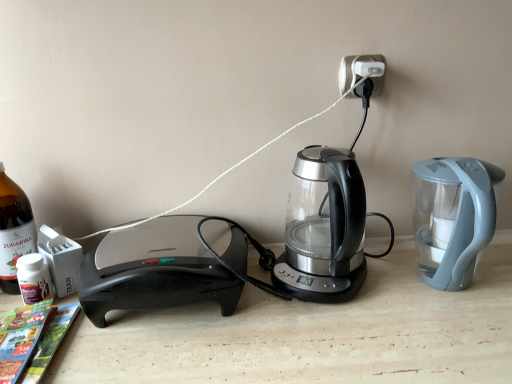
Measure the distance between bottle glass at left and camera.

A distance of 30.66 inches exists between bottle glass at left and camera.

I want to click on bottle glass at left, so click(14, 231).

What do you see at coordinates (362, 71) in the screenshot? I see `white plastic electric outlet at upper center` at bounding box center [362, 71].

Identify the location of bottle glass at left. (14, 231).

Is point (6, 232) closer to camera compared to point (379, 58)?

Yes.

Is white plastic electric outlet at upper center at the back of bottle glass at left?

bottle glass at left does not have its back to white plastic electric outlet at upper center.

In the scene shown: Considering the relative sizes of bottle glass at left and white plastic electric outlet at upper center in the image provided, is bottle glass at left smaller than white plastic electric outlet at upper center?

Actually, bottle glass at left might be larger than white plastic electric outlet at upper center.

Considering the positions of objects bottle glass at left and white plastic electric outlet at upper center in the image provided, who is more to the left, bottle glass at left or white plastic electric outlet at upper center?

bottle glass at left is more to the left.

From a real-world perspective, is transparent glass kettle at center located beneath white plastic electric outlet at upper center?

Yes, from a real-world perspective, transparent glass kettle at center is under white plastic electric outlet at upper center.

Is transparent glass kettle at center positioned beyond the bounds of white plastic electric outlet at upper center?

transparent glass kettle at center lies outside white plastic electric outlet at upper center's area.

In the image, is transparent glass kettle at center positioned in front of or behind white plastic electric outlet at upper center?

Clearly, transparent glass kettle at center is in front of white plastic electric outlet at upper center.

Is transparent glass kettle at center in contact with white plastic electric outlet at upper center?

They are not placed beside each other.

Looking at their sizes, would you say transparent glass kettle at center is wider or thinner than bottle glass at left?

In the image, transparent glass kettle at center appears to be wider than bottle glass at left.

From the picture: From the image's perspective, does transparent glass kettle at center appear higher than bottle glass at left?

Correct, transparent glass kettle at center appears higher than bottle glass at left in the image.

In the image, there is a bottle glass at left. Identify the location of kettle above it (from the image's perspective). The width and height of the screenshot is (512, 384). (324, 228).

Which is more to the right, transparent glass kettle at center or bottle glass at left?

Positioned to the right is transparent glass kettle at center.

Based on the photo, is matte paper magazine at lower left bigger than bottle glass at left?

Incorrect, matte paper magazine at lower left is not larger than bottle glass at left.

Relative to bottle glass at left, is matte paper magazine at lower left in front or behind?

In the image, matte paper magazine at lower left appears in front of bottle glass at left.

Which object is positioned more to the left, matte paper magazine at lower left or bottle glass at left?

bottle glass at left.

Considering the relative sizes of matte paper magazine at lower left and bottle glass at left in the image provided, is matte paper magazine at lower left taller than bottle glass at left?

No.

Which object is positioned more to the left, white plastic electric outlet at upper center or bottle glass at left?

bottle glass at left.

From the image's perspective, does white plastic electric outlet at upper center appear higher than bottle glass at left?

Correct, white plastic electric outlet at upper center appears higher than bottle glass at left in the image.

From a real-world perspective, relative to bottle glass at left, is white plastic electric outlet at upper center vertically above or below?

Clearly, from a real-world perspective, white plastic electric outlet at upper center is above bottle glass at left.

Could you tell me if white plastic electric outlet at upper center is facing bottle glass at left?

No, white plastic electric outlet at upper center is not aimed at bottle glass at left.

Measure the distance from matte paper magazine at lower left to transparent glass kettle at center.

matte paper magazine at lower left is 18.43 inches from transparent glass kettle at center.

Could transparent glass kettle at center be considered to be inside matte paper magazine at lower left?

Actually, transparent glass kettle at center is outside matte paper magazine at lower left.

Considering the relative sizes of matte paper magazine at lower left and transparent glass kettle at center in the image provided, is matte paper magazine at lower left wider than transparent glass kettle at center?

Correct, the width of matte paper magazine at lower left exceeds that of transparent glass kettle at center.

Between point (307, 246) and point (49, 348), which one is positioned behind?

Point (307, 246)

Between transparent glass kettle at center and matte paper magazine at lower left, which one has smaller width?

Thinner between the two is transparent glass kettle at center.

Visually, is transparent glass kettle at center positioned to the left or to the right of matte paper magazine at lower left?

transparent glass kettle at center is to the right of matte paper magazine at lower left.

Is matte paper magazine at lower left at the back of transparent glass kettle at center?

No.

Where is `electric outlet that is above the bottle glass at left (from the image's perspective)`? electric outlet that is above the bottle glass at left (from the image's perspective) is located at coordinates (362, 71).

At what (x,y) coordinates should I click in order to perform the action: click on kettle in front of the white plastic electric outlet at upper center. Please return your answer as a coordinate pair (x, y). This screenshot has width=512, height=384. Looking at the image, I should click on (324, 228).

From the image, which object appears to be farther from transparent glass kettle at center, matte paper magazine at lower left or white plastic electric outlet at upper center?

matte paper magazine at lower left is further to transparent glass kettle at center.

Based on their spatial positions, is bottle glass at left or white plastic electric outlet at upper center further from matte paper magazine at lower left?

The object further to matte paper magazine at lower left is white plastic electric outlet at upper center.

Which object lies further to the anchor point bottle glass at left, matte paper magazine at lower left or white plastic electric outlet at upper center?

Based on the image, white plastic electric outlet at upper center appears to be further to bottle glass at left.

When comparing their distances from white plastic electric outlet at upper center, does bottle glass at left or matte paper magazine at lower left seem closer?

matte paper magazine at lower left is closer to white plastic electric outlet at upper center.

Which object lies further to the anchor point bottle glass at left, matte paper magazine at lower left or transparent glass kettle at center?

transparent glass kettle at center.

From the picture: When comparing their distances from transparent glass kettle at center, does white plastic electric outlet at upper center or bottle glass at left seem closer?

The object closer to transparent glass kettle at center is white plastic electric outlet at upper center.

From the image, which object appears to be nearer to white plastic electric outlet at upper center, transparent glass kettle at center or matte paper magazine at lower left?

Among the two, transparent glass kettle at center is located nearer to white plastic electric outlet at upper center.

Considering their positions, is white plastic electric outlet at upper center positioned closer to bottle glass at left than matte paper magazine at lower left?

matte paper magazine at lower left is closer to bottle glass at left.

Locate an element on the screen. magazine situated between bottle glass at left and transparent glass kettle at center from left to right is located at coordinates (50, 342).

You are a GUI agent. You are given a task and a screenshot of the screen. Output one action in this format:
    pyautogui.click(x=<x>, y=<y>)
    Task: Click on the kettle between bottle glass at left and white plastic electric outlet at upper center from left to right
    This screenshot has width=512, height=384.
    Given the screenshot: What is the action you would take?
    pyautogui.click(x=324, y=228)

You are a GUI agent. You are given a task and a screenshot of the screen. Output one action in this format:
    pyautogui.click(x=<x>, y=<y>)
    Task: Click on the magazine located between bottle glass at left and white plastic electric outlet at upper center in the left-right direction
    
    Given the screenshot: What is the action you would take?
    pyautogui.click(x=50, y=342)

Image resolution: width=512 pixels, height=384 pixels. Find the location of `kettle between matte paper magazine at lower left and white plastic electric outlet at upper center from left to right`. kettle between matte paper magazine at lower left and white plastic electric outlet at upper center from left to right is located at coordinates (324, 228).